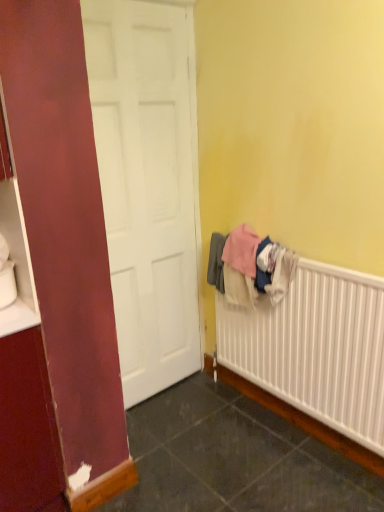
In order to click on white textured radiator at lower right in this screenshot , I will do `click(315, 348)`.

Describe the element at coordinates (315, 348) in the screenshot. I see `white textured radiator at lower right` at that location.

Where is `soft cotton towels at right`? This screenshot has height=512, width=384. soft cotton towels at right is located at coordinates (249, 267).

Describe the element at coordinates (249, 267) in the screenshot. The image size is (384, 512). I see `soft cotton towels at right` at that location.

The height and width of the screenshot is (512, 384). In order to click on white textured radiator at lower right in this screenshot , I will do `click(315, 348)`.

Based on their positions, is soft cotton towels at right located to the left or right of white textured radiator at lower right?

soft cotton towels at right is to the left of white textured radiator at lower right.

Who is more distant, soft cotton towels at right or white textured radiator at lower right?

soft cotton towels at right is behind.

Is point (286, 271) closer to camera compared to point (225, 295)?

Yes.

From the image's perspective, which object appears higher, soft cotton towels at right or white textured radiator at lower right?

From the image's view, soft cotton towels at right is above.

From the picture: From a real-world perspective, is soft cotton towels at right physically above white textured radiator at lower right?

Indeed, from a real-world perspective, soft cotton towels at right stands above white textured radiator at lower right.

Does soft cotton towels at right have a lesser width compared to white textured radiator at lower right?

Yes, soft cotton towels at right is thinner than white textured radiator at lower right.

Does soft cotton towels at right have a lesser height compared to white textured radiator at lower right?

Yes, soft cotton towels at right is shorter than white textured radiator at lower right.

Which of these two, soft cotton towels at right or white textured radiator at lower right, is bigger?

white textured radiator at lower right.

Can we say soft cotton towels at right lies outside white textured radiator at lower right?

No, most part of soft cotton towels at right lies within white textured radiator at lower right.

Would you say soft cotton towels at right is a long distance from white textured radiator at lower right?

They are positioned close to each other.

Is soft cotton towels at right facing away from white textured radiator at lower right?

Yes, soft cotton towels at right is facing away from white textured radiator at lower right.

I want to click on clothing that appears above the white textured radiator at lower right (from the image's perspective), so click(249, 267).

Is white textured radiator at lower right to the left of soft cotton towels at right from the viewer's perspective?

No.

Is the position of white textured radiator at lower right more distant than that of soft cotton towels at right?

No, white textured radiator at lower right is in front of soft cotton towels at right.

Between point (376, 305) and point (231, 300), which one is positioned behind?

The point (231, 300) is farther from the camera.

From the image's perspective, is white textured radiator at lower right above soft cotton towels at right?

Incorrect, from the image's perspective, white textured radiator at lower right is lower than soft cotton towels at right.

From a real-world perspective, who is located lower, white textured radiator at lower right or soft cotton towels at right?

In real-world perspective, white textured radiator at lower right is lower.

Looking at their sizes, would you say white textured radiator at lower right is wider or thinner than soft cotton towels at right?

Clearly, white textured radiator at lower right has more width compared to soft cotton towels at right.

Considering the sizes of objects white textured radiator at lower right and soft cotton towels at right in the image provided, who is shorter, white textured radiator at lower right or soft cotton towels at right?

soft cotton towels at right is shorter.

In terms of size, does white textured radiator at lower right appear bigger or smaller than soft cotton towels at right?

Considering their sizes, white textured radiator at lower right takes up more space than soft cotton towels at right.

Is white textured radiator at lower right spatially inside soft cotton towels at right, or outside of it?

The correct answer is: outside.

Consider the image. Does white textured radiator at lower right touch soft cotton towels at right?

No, white textured radiator at lower right is not making contact with soft cotton towels at right.

Is white textured radiator at lower right facing away from soft cotton towels at right?

Yes, soft cotton towels at right is at the back of white textured radiator at lower right.

Measure the distance from white textured radiator at lower right to soft cotton towels at right.

A distance of 24.45 centimeters exists between white textured radiator at lower right and soft cotton towels at right.

I want to click on clothing on the left of white textured radiator at lower right, so click(249, 267).

This screenshot has width=384, height=512. I want to click on clothing behind the white textured radiator at lower right, so click(x=249, y=267).

Image resolution: width=384 pixels, height=512 pixels. In order to click on clothing that appears above the white textured radiator at lower right (from the image's perspective) in this screenshot , I will do (249, 267).